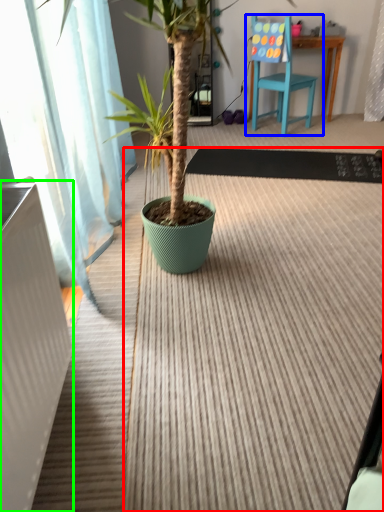
Question: Which object is positioned closest to doormat (highlighted by a red box)? Select from chair (highlighted by a blue box) and radiator (highlighted by a green box).

Choices:
 (A) chair
 (B) radiator

Answer: (B)